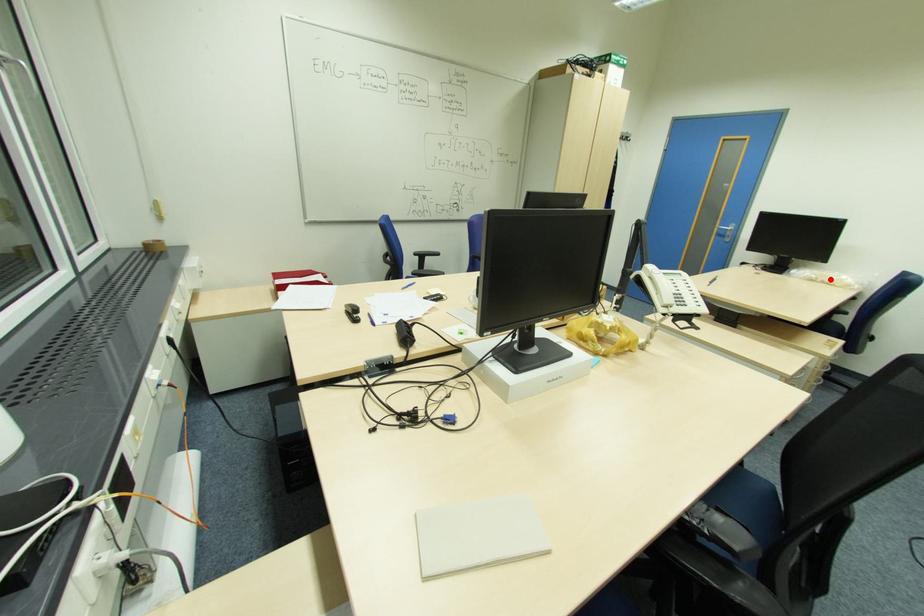
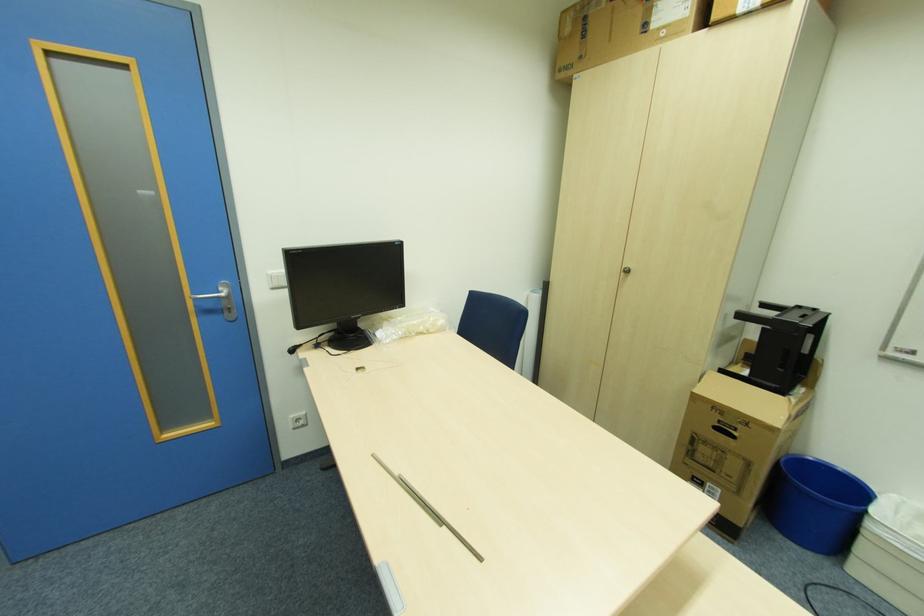
Where in the second image is the point corresponding to the highlighted location from the first image?

(424, 329)